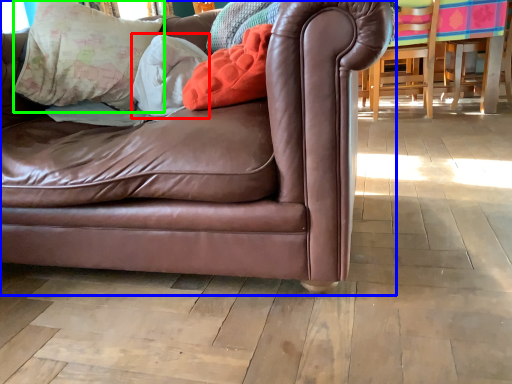
Question: Which is farther away from pillow (highlighted by a red box)? studio couch (highlighted by a blue box) or pillow (highlighted by a green box)?

Choices:
 (A) studio couch
 (B) pillow

Answer: (A)